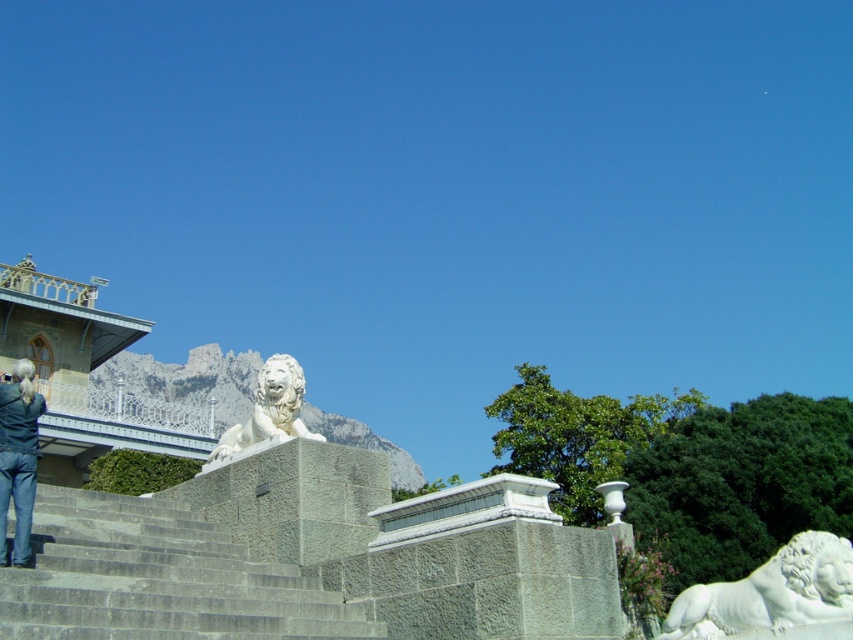
Does white marble lion at lower right appear on the left side of white marble lion at center?

In fact, white marble lion at lower right is to the right of white marble lion at center.

Is the position of white marble lion at lower right less distant than that of white marble lion at center?

That is True.

Is point (799, 538) positioned after point (218, 444)?

No, it is not.

Identify the location of white marble lion at lower right. (770, 593).

Is white marble lion at lower right wider than denim jacket at lower left?

Incorrect, white marble lion at lower right's width does not surpass denim jacket at lower left's.

From the picture: Is white marble lion at lower right below denim jacket at lower left?

Yes.

The width and height of the screenshot is (853, 640). In order to click on white marble lion at lower right in this screenshot , I will do `click(770, 593)`.

Locate an element on the screen. white marble lion at lower right is located at coordinates pyautogui.click(x=770, y=593).

Can you confirm if gray stone stairs at center is wider than white marble lion at center?

In fact, gray stone stairs at center might be narrower than white marble lion at center.

Measure the distance between gray stone stairs at center and white marble lion at center.

gray stone stairs at center and white marble lion at center are 24.02 feet apart from each other.

Is point (271, 604) positioned in front of point (257, 401)?

Yes, it is in front of point (257, 401).

Locate an element on the screen. gray stone stairs at center is located at coordinates (155, 579).